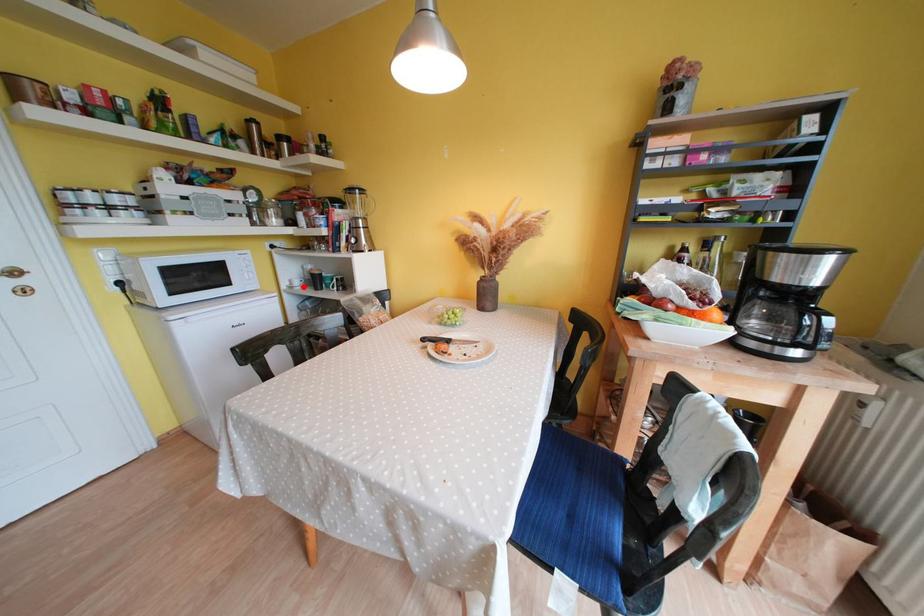
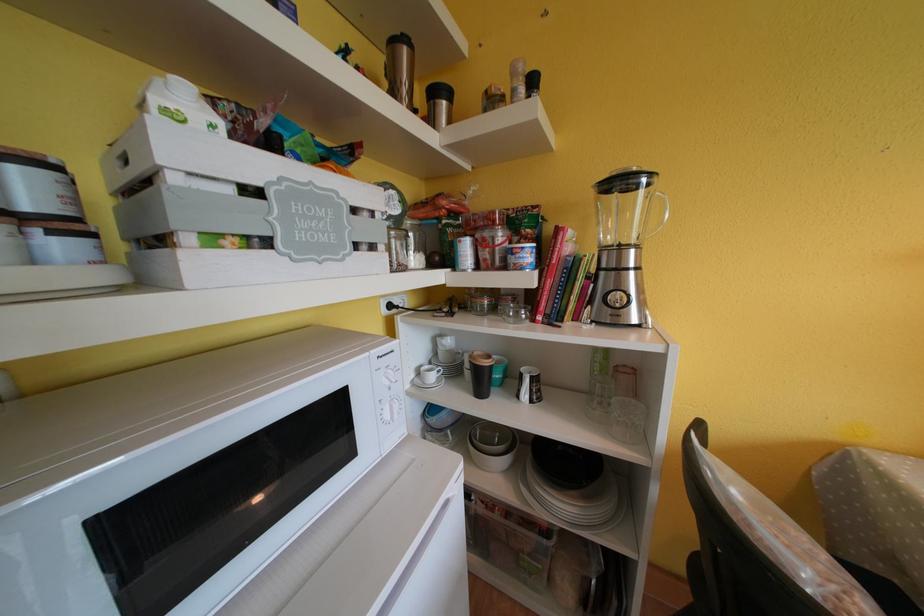
Find the pixel in the second image that matches the highlighted location in the first image.

(439, 381)